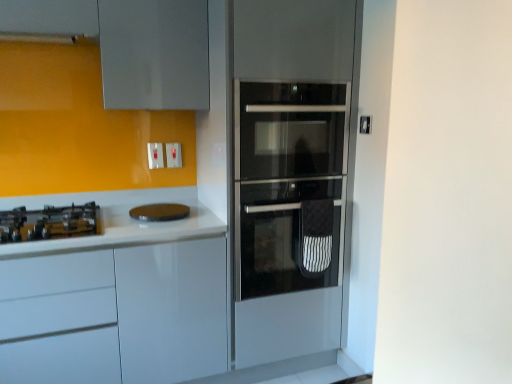
The width and height of the screenshot is (512, 384). What do you see at coordinates (49, 223) in the screenshot?
I see `yellow matte gas stove at left` at bounding box center [49, 223].

Identify the location of brown matte cutting board at center. This screenshot has height=384, width=512. (160, 212).

Which of these two, white plastic switch at upper center, acting as the second electric outlet starting from the right, or yellow matte gas stove at left, is bigger?

Bigger between the two is yellow matte gas stove at left.

From a real-world perspective, which electric outlet is the 2nd one above the yellow matte gas stove at left? Please provide its 2D coordinates.

[(155, 155)]

Does white plastic switch at upper center, acting as the second electric outlet starting from the right, contain yellow matte gas stove at left?

No, yellow matte gas stove at left is not inside white plastic switch at upper center, acting as the second electric outlet starting from the right.

Is white plastic switch at upper center, the second electric outlet when ordered from left to right, surrounded by stainless steel oven at center?

No, white plastic switch at upper center, the second electric outlet when ordered from left to right, is not a part of stainless steel oven at center.

Does point (270, 213) come behind point (177, 146)?

No, it is not.

Is stainless steel oven at center looking in the opposite direction of white plastic switch at upper center, the second electric outlet when ordered from left to right?

stainless steel oven at center is not turned away from white plastic switch at upper center, the second electric outlet when ordered from left to right.

Measure the distance from brown matte cutting board at center to yellow matte gas stove at left.

brown matte cutting board at center is 16.59 inches away from yellow matte gas stove at left.

Considering the sizes of objects brown matte cutting board at center and yellow matte gas stove at left in the image provided, who is thinner, brown matte cutting board at center or yellow matte gas stove at left?

With smaller width is brown matte cutting board at center.

How different are the orientations of brown matte cutting board at center and yellow matte gas stove at left in degrees?

The facing directions of brown matte cutting board at center and yellow matte gas stove at left are 0.000274 degrees apart.

From the picture: Considering the positions of objects brown matte cutting board at center and yellow matte gas stove at left in the image provided, who is behind, brown matte cutting board at center or yellow matte gas stove at left?

Positioned behind is brown matte cutting board at center.

From the image's perspective, which object appears higher, white glossy cabinet at left or white plastic switch at upper center, acting as the second electric outlet starting from the right?

white plastic switch at upper center, acting as the second electric outlet starting from the right, from the image's perspective.

Can white plastic switch at upper center, which is counted as the 1th electric outlet, starting from the left, be found inside white glossy cabinet at left?

That's incorrect, white plastic switch at upper center, which is counted as the 1th electric outlet, starting from the left, is not inside white glossy cabinet at left.

Does white glossy cabinet at left touch white plastic switch at upper center, which is counted as the 1th electric outlet, starting from the left?

No, white glossy cabinet at left is not touching white plastic switch at upper center, which is counted as the 1th electric outlet, starting from the left.

Is white glossy cabinet at left at the left side of white plastic switch at upper center, acting as the second electric outlet starting from the right?

Yes.

Between brown matte cutting board at center and white glossy cabinet at left, which one appears on the right side from the viewer's perspective?

From the viewer's perspective, brown matte cutting board at center appears more on the right side.

Is white glossy cabinet at left at the back of brown matte cutting board at center?

No, brown matte cutting board at center's orientation is not away from white glossy cabinet at left.

Based on the photo, is brown matte cutting board at center completely or partially outside of white glossy cabinet at left?

brown matte cutting board at center lies outside white glossy cabinet at left's area.

Image resolution: width=512 pixels, height=384 pixels. Find the location of `cabinetry below the brown matte cutting board at center (from the image's perspective)`. cabinetry below the brown matte cutting board at center (from the image's perspective) is located at coordinates (116, 315).

Is white plastic switch at upper center, the second electric outlet when ordered from left to right, inside or outside of white plastic switch at upper center, which is counted as the 1th electric outlet, starting from the left?

The correct answer is: outside.

From the image's perspective, would you say white plastic switch at upper center, placed as the first electric outlet when sorted from right to left, is positioned over white plastic switch at upper center, acting as the second electric outlet starting from the right?

Yes, from the image's perspective, white plastic switch at upper center, placed as the first electric outlet when sorted from right to left, is on top of white plastic switch at upper center, acting as the second electric outlet starting from the right.

Does white plastic switch at upper center, placed as the first electric outlet when sorted from right to left, have a lesser height compared to white plastic switch at upper center, acting as the second electric outlet starting from the right?

Correct, white plastic switch at upper center, placed as the first electric outlet when sorted from right to left, is not as tall as white plastic switch at upper center, acting as the second electric outlet starting from the right.

Is white plastic switch at upper center, the second electric outlet when ordered from left to right, far from white plastic switch at upper center, acting as the second electric outlet starting from the right?

That's not correct — white plastic switch at upper center, the second electric outlet when ordered from left to right, is a little close to white plastic switch at upper center, acting as the second electric outlet starting from the right.

Looking at their sizes, would you say stainless steel oven at center is wider or thinner than white plastic switch at upper center, which is counted as the 1th electric outlet, starting from the left?

Considering their sizes, stainless steel oven at center looks broader than white plastic switch at upper center, which is counted as the 1th electric outlet, starting from the left.

Is stainless steel oven at center smaller than white plastic switch at upper center, acting as the second electric outlet starting from the right?

Incorrect, stainless steel oven at center is not smaller in size than white plastic switch at upper center, acting as the second electric outlet starting from the right.

Which object is closer to the camera taking this photo, stainless steel oven at center or white plastic switch at upper center, acting as the second electric outlet starting from the right?

stainless steel oven at center is closer to the camera.

Are stainless steel oven at center and white plastic switch at upper center, acting as the second electric outlet starting from the right, far apart?

No, there isn't a large distance between stainless steel oven at center and white plastic switch at upper center, acting as the second electric outlet starting from the right.

This screenshot has height=384, width=512. I want to click on the 1st electric outlet behind the yellow matte gas stove at left, starting your count from the anchor, so click(x=155, y=155).

In the image, there is a white plastic switch at upper center, placed as the first electric outlet when sorted from right to left. Where is `oven below it (from the image's perspective)`? The width and height of the screenshot is (512, 384). oven below it (from the image's perspective) is located at coordinates (287, 235).

Which object lies further to the anchor point white glossy cabinet at left, white plastic switch at upper center, which is counted as the 1th electric outlet, starting from the left, or yellow matte gas stove at left?

The object further to white glossy cabinet at left is white plastic switch at upper center, which is counted as the 1th electric outlet, starting from the left.

From the image, which object appears to be farther from brown matte cutting board at center, white plastic switch at upper center, placed as the first electric outlet when sorted from right to left, or yellow matte gas stove at left?

yellow matte gas stove at left.

Looking at the image, which one is located further to white plastic switch at upper center, which is counted as the 1th electric outlet, starting from the left, yellow matte gas stove at left or white glossy cabinet at left?

white glossy cabinet at left.

Which object lies nearer to the anchor point yellow matte gas stove at left, white glossy cabinet at left or brown matte cutting board at center?

white glossy cabinet at left is closer to yellow matte gas stove at left.

Looking at the image, which one is located closer to yellow matte gas stove at left, stainless steel oven at center or brown matte cutting board at center?

The object closer to yellow matte gas stove at left is brown matte cutting board at center.

Based on their spatial positions, is white plastic switch at upper center, which is counted as the 1th electric outlet, starting from the left, or white plastic switch at upper center, placed as the first electric outlet when sorted from right to left, further from brown matte cutting board at center?

Based on the image, white plastic switch at upper center, placed as the first electric outlet when sorted from right to left, appears to be further to brown matte cutting board at center.

From the image, which object appears to be nearer to white plastic switch at upper center, placed as the first electric outlet when sorted from right to left, stainless steel oven at center or white plastic switch at upper center, which is counted as the 1th electric outlet, starting from the left?

white plastic switch at upper center, which is counted as the 1th electric outlet, starting from the left, lies closer to white plastic switch at upper center, placed as the first electric outlet when sorted from right to left, than the other object.

Looking at the image, which one is located further to stainless steel oven at center, white plastic switch at upper center, acting as the second electric outlet starting from the right, or white plastic switch at upper center, placed as the first electric outlet when sorted from right to left?

Among the two, white plastic switch at upper center, acting as the second electric outlet starting from the right, is located further to stainless steel oven at center.

You are a GUI agent. You are given a task and a screenshot of the screen. Output one action in this format:
    pyautogui.click(x=<x>, y=<y>)
    Task: Click on the gas stove positioned between white glossy cabinet at left and white plastic switch at upper center, placed as the first electric outlet when sorted from right to left, from near to far
    This screenshot has width=512, height=384.
    Given the screenshot: What is the action you would take?
    pyautogui.click(x=49, y=223)

Identify the location of electric outlet between brown matte cutting board at center and white plastic switch at upper center, placed as the first electric outlet when sorted from right to left, along the z-axis. The width and height of the screenshot is (512, 384). (155, 155).

You are a GUI agent. You are given a task and a screenshot of the screen. Output one action in this format:
    pyautogui.click(x=<x>, y=<y>)
    Task: Click on the electric outlet between brown matte cutting board at center and stainless steel oven at center in the horizontal direction
    
    Given the screenshot: What is the action you would take?
    pyautogui.click(x=173, y=155)

Locate an element on the screen. home appliance between white glossy cabinet at left and stainless steel oven at center in the horizontal direction is located at coordinates (160, 212).